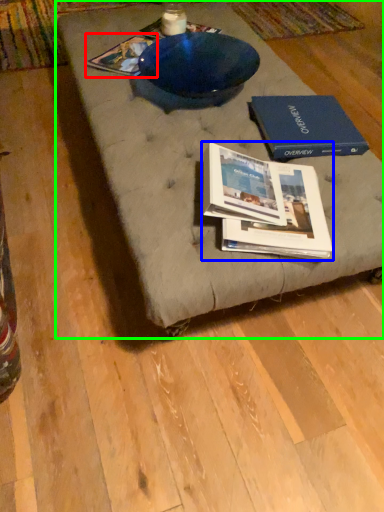
Question: Which object is positioned farthest from book (highlighted by a red box)? Select from book (highlighted by a blue box) and coffee table (highlighted by a green box).

Choices:
 (A) book
 (B) coffee table

Answer: (A)